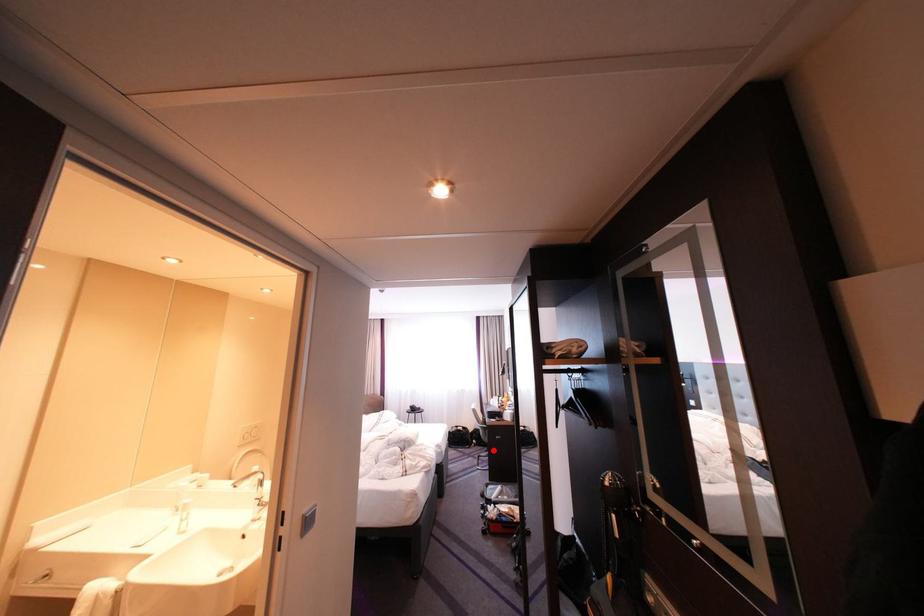
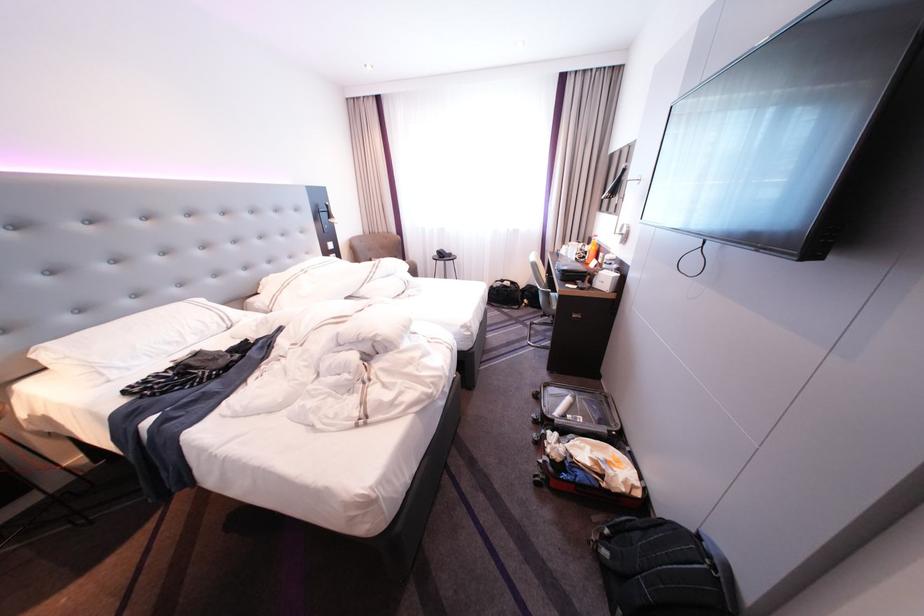
Find the pixel in the second image that matches the highlighted location in the first image.

(546, 314)